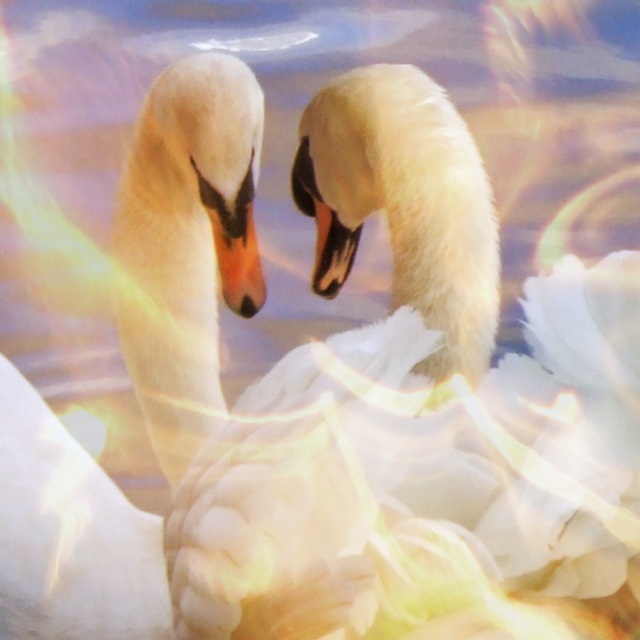
Between matte orange beak at center and black glossy beak at center, which one is positioned higher?

A: black glossy beak at center

Is matte orange beak at center to the left of black glossy beak at center from the viewer's perspective?

Yes, matte orange beak at center is to the left of black glossy beak at center.

Where is `matte orange beak at center`? The height and width of the screenshot is (640, 640). matte orange beak at center is located at coordinates (237, 257).